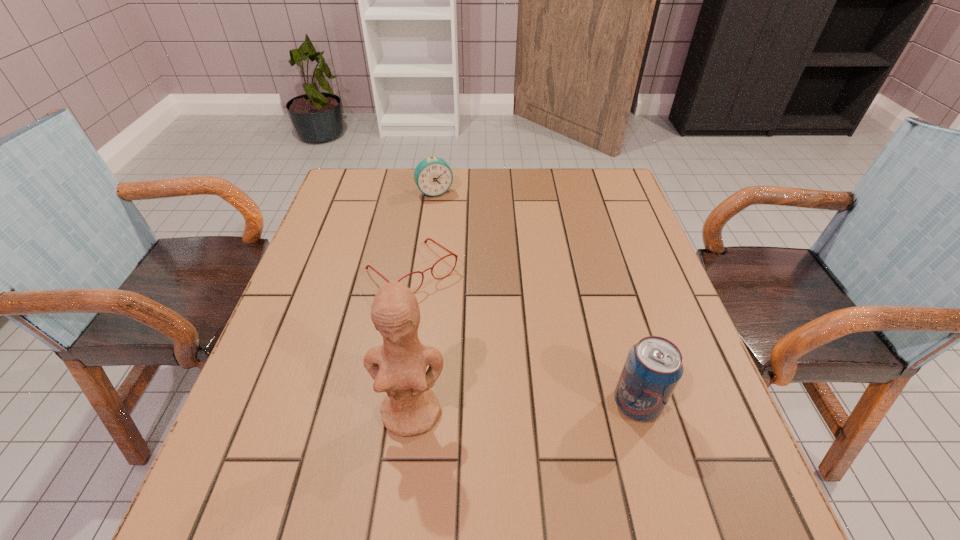
In the image, there is a desktop. Identify the location of vacant area at the far edge. The height and width of the screenshot is (540, 960). (472, 196).

Find the location of `vacant space at the near edge of the desktop`. vacant space at the near edge of the desktop is located at coordinates (349, 457).

In the image, there is a desktop. Where is `vacant space at the left edge`? vacant space at the left edge is located at coordinates (350, 217).

In the image, there is a desktop. Where is `free space at the right edge`? free space at the right edge is located at coordinates (592, 242).

Where is `vacant space at the far left corner of the desktop`? This screenshot has height=540, width=960. vacant space at the far left corner of the desktop is located at coordinates (x=349, y=193).

This screenshot has width=960, height=540. In order to click on vacant space at the near left corner in this screenshot , I will do `click(276, 428)`.

Image resolution: width=960 pixels, height=540 pixels. In order to click on free region at the far right corner of the desktop in this screenshot , I will do `click(585, 194)`.

Locate an element on the screen. vacant space in between the shortest object and the farthest object is located at coordinates (423, 232).

This screenshot has height=540, width=960. What are the coordinates of `empty space that is in between the third shortest object and the tallest object` in the screenshot? It's located at (524, 408).

At what (x,y) coordinates should I click in order to perform the action: click on blank region between the figurine and the second shortest object. Please return your answer as a coordinate pair (x, y). Looking at the image, I should click on (423, 302).